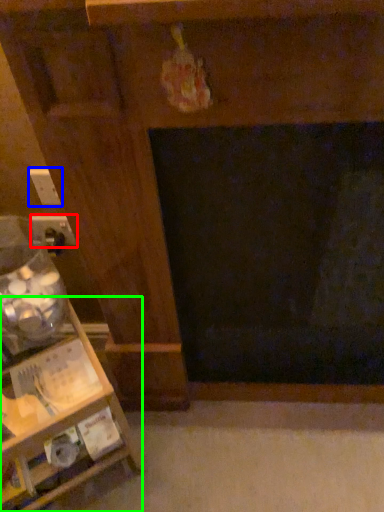
Question: Considering the real-world distances, which object is closest to electric outlet (highlighted by a red box)? electric outlet (highlighted by a blue box) or furniture (highlighted by a green box).

Choices:
 (A) electric outlet
 (B) furniture

Answer: (A)